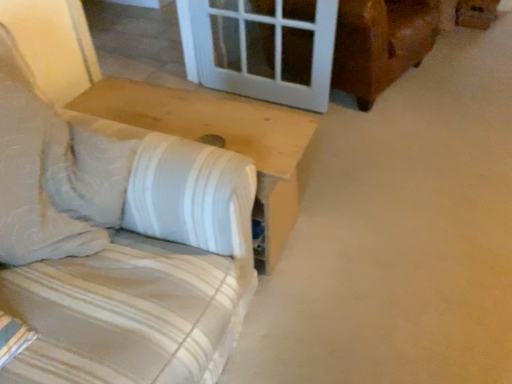
Question: Can you confirm if white striped fabric couch at left is positioned to the left of white wood table at lower left?

Choices:
 (A) no
 (B) yes

Answer: (B)

Question: Does white striped fabric couch at left have a lesser height compared to white wood table at lower left?

Choices:
 (A) yes
 (B) no

Answer: (A)

Question: Does white striped fabric couch at left have a lesser width compared to white wood table at lower left?

Choices:
 (A) yes
 (B) no

Answer: (B)

Question: Can you confirm if white striped fabric couch at left is positioned to the right of white wood table at lower left?

Choices:
 (A) no
 (B) yes

Answer: (A)

Question: Considering the relative sizes of white striped fabric couch at left and white wood table at lower left in the image provided, is white striped fabric couch at left bigger than white wood table at lower left?

Choices:
 (A) no
 (B) yes

Answer: (B)

Question: Is white striped fabric couch at left outside of white wood table at lower left?

Choices:
 (A) no
 (B) yes

Answer: (B)

Question: Considering the relative positions of brown cardboard box at upper right and white wood table at lower left in the image provided, is brown cardboard box at upper right behind white wood table at lower left?

Choices:
 (A) no
 (B) yes

Answer: (B)

Question: Is brown cardboard box at upper right bigger than white wood table at lower left?

Choices:
 (A) no
 (B) yes

Answer: (A)

Question: Is brown cardboard box at upper right far from white wood table at lower left?

Choices:
 (A) yes
 (B) no

Answer: (A)

Question: Is brown cardboard box at upper right beside white wood table at lower left?

Choices:
 (A) no
 (B) yes

Answer: (A)

Question: Considering the relative sizes of brown cardboard box at upper right and white wood table at lower left in the image provided, is brown cardboard box at upper right shorter than white wood table at lower left?

Choices:
 (A) yes
 (B) no

Answer: (A)

Question: From a real-world perspective, is brown cardboard box at upper right over white wood table at lower left?

Choices:
 (A) yes
 (B) no

Answer: (B)

Question: Considering the relative sizes of brown cardboard box at upper right and white striped fabric couch at left in the image provided, is brown cardboard box at upper right wider than white striped fabric couch at left?

Choices:
 (A) no
 (B) yes

Answer: (A)